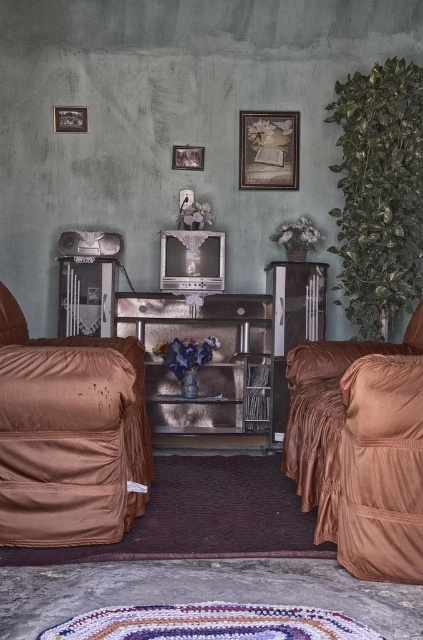
What do you see at coordinates (69, 120) in the screenshot? Image resolution: width=423 pixels, height=640 pixels. I see `wooden picture frame at upper left` at bounding box center [69, 120].

Is wooden picture frame at upper left above wooden picture frame at upper center?

Indeed, wooden picture frame at upper left is positioned over wooden picture frame at upper center.

This screenshot has height=640, width=423. Describe the element at coordinates (69, 120) in the screenshot. I see `wooden picture frame at upper left` at that location.

Identify the location of wooden picture frame at upper left. (69, 120).

Is metallic cabinet at center further to camera compared to wooden picture frame at upper center?

No.

This screenshot has width=423, height=640. What do you see at coordinates (205, 369) in the screenshot?
I see `metallic cabinet at center` at bounding box center [205, 369].

At what (x,y) coordinates should I click in order to perform the action: click on metallic cabinet at center. Please return your answer as a coordinate pair (x, y). The width and height of the screenshot is (423, 640). Looking at the image, I should click on pyautogui.click(x=205, y=369).

Is wooden frame at upper center behind wooden picture frame at upper left?

Yes, wooden frame at upper center is behind wooden picture frame at upper left.

Is wooden frame at upper center thinner than wooden picture frame at upper left?

In fact, wooden frame at upper center might be wider than wooden picture frame at upper left.

The height and width of the screenshot is (640, 423). In order to click on wooden frame at upper center in this screenshot , I will do `click(269, 148)`.